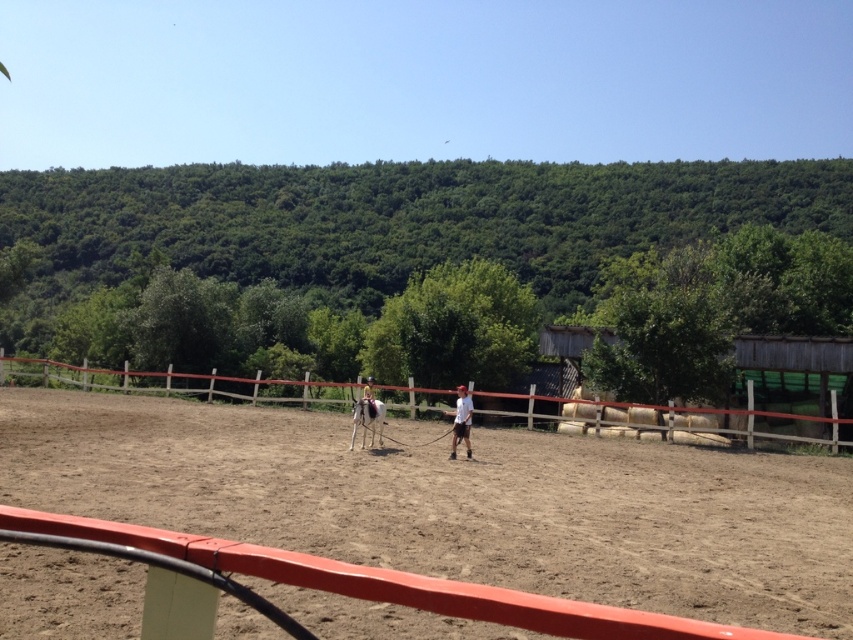
Can you confirm if brown wooden fence at center is positioned to the left of white glossy horse at center?

Indeed, brown wooden fence at center is positioned on the left side of white glossy horse at center.

Looking at this image, is brown wooden fence at center wider than white glossy horse at center?

Correct, the width of brown wooden fence at center exceeds that of white glossy horse at center.

Does point (724, 429) come farther from viewer compared to point (373, 438)?

Yes, it is behind point (373, 438).

You are a GUI agent. You are given a task and a screenshot of the screen. Output one action in this format:
    pyautogui.click(x=<x>, y=<y>)
    Task: Click on the brown wooden fence at center
    
    Given the screenshot: What is the action you would take?
    pyautogui.click(x=670, y=420)

Which is in front, point (276, 381) or point (366, 376)?

Positioned in front is point (276, 381).

Can you confirm if brown wooden fence at center is smaller than light brown leather jacket at center?

Actually, brown wooden fence at center might be larger than light brown leather jacket at center.

At what (x,y) coordinates should I click in order to perform the action: click on brown wooden fence at center. Please return your answer as a coordinate pair (x, y). This screenshot has height=640, width=853. Looking at the image, I should click on (670, 420).

Can you confirm if brown wooden fence at center is positioned to the left of white matte shirt at center?

Indeed, brown wooden fence at center is positioned on the left side of white matte shirt at center.

Who is more forward, (606, 435) or (457, 387)?

Positioned in front is point (606, 435).

Does point (230, 387) lie in front of point (456, 435)?

No, it is behind (456, 435).

The width and height of the screenshot is (853, 640). In order to click on brown wooden fence at center in this screenshot , I will do `click(670, 420)`.